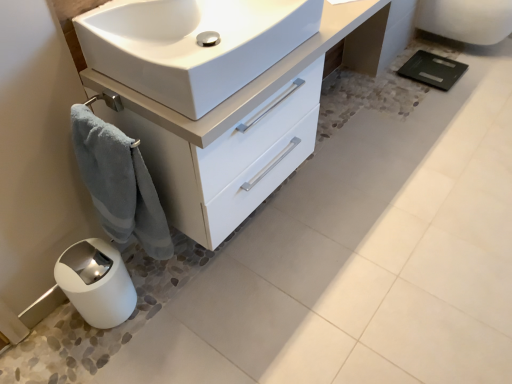
Question: Can you confirm if blue plush towel at lower left is bigger than white glossy cabinet at lower left?

Choices:
 (A) yes
 (B) no

Answer: (B)

Question: Is white glossy cabinet at lower left completely or partially inside blue plush towel at lower left?

Choices:
 (A) no
 (B) yes

Answer: (A)

Question: Does blue plush towel at lower left turn towards white glossy cabinet at lower left?

Choices:
 (A) yes
 (B) no

Answer: (B)

Question: From the image's perspective, is blue plush towel at lower left located beneath white glossy cabinet at lower left?

Choices:
 (A) no
 (B) yes

Answer: (B)

Question: Is blue plush towel at lower left located outside white glossy cabinet at lower left?

Choices:
 (A) yes
 (B) no

Answer: (A)

Question: Considering the positions of point (109, 92) and point (253, 66), is point (109, 92) closer or farther from the camera than point (253, 66)?

Choices:
 (A) closer
 (B) farther

Answer: (B)

Question: In terms of size, does white glossy cabinet at lower left appear bigger or smaller than white glossy sink at center?

Choices:
 (A) small
 (B) big

Answer: (B)

Question: Relative to white glossy sink at center, is white glossy cabinet at lower left in front or behind?

Choices:
 (A) front
 (B) behind

Answer: (B)

Question: From the image's perspective, is white glossy cabinet at lower left located above or below white glossy sink at center?

Choices:
 (A) above
 (B) below

Answer: (A)

Question: In terms of size, does white glossy sink at center appear bigger or smaller than white glossy porcelain at upper right?

Choices:
 (A) small
 (B) big

Answer: (A)

Question: Relative to white glossy porcelain at upper right, is white glossy sink at center in front or behind?

Choices:
 (A) front
 (B) behind

Answer: (A)

Question: From the image's perspective, relative to white glossy porcelain at upper right, is white glossy sink at center above or below?

Choices:
 (A) above
 (B) below

Answer: (B)

Question: Is white glossy sink at center taller or shorter than white glossy porcelain at upper right?

Choices:
 (A) short
 (B) tall

Answer: (A)

Question: Do you think white glossy porcelain at upper right is within white glossy sink at center, or outside of it?

Choices:
 (A) inside
 (B) outside

Answer: (B)

Question: From a real-world perspective, relative to white glossy sink at center, is white glossy porcelain at upper right vertically above or below?

Choices:
 (A) below
 (B) above

Answer: (A)